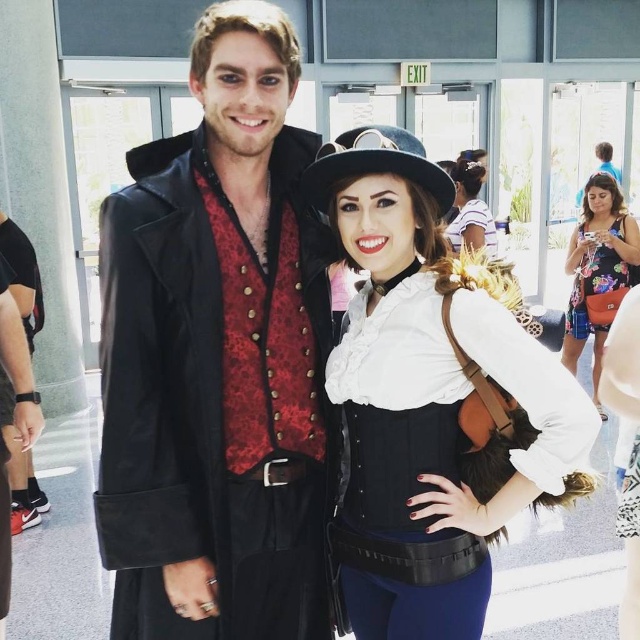
Question: Which point appears closest to the camera in this image?

Choices:
 (A) (580, 276)
 (B) (616, 211)

Answer: (B)

Question: Which point is farther to the camera?

Choices:
 (A) (618, 241)
 (B) (154, 461)
 (C) (456, 180)

Answer: (C)

Question: Which of the following is the closest to the observer?

Choices:
 (A) (620, 211)
 (B) (588, 298)
 (C) (465, 358)
 (D) (176, 529)

Answer: (D)

Question: Is floral print fabric dress at right closer to the viewer compared to white matte hat at upper center?

Choices:
 (A) no
 (B) yes

Answer: (A)

Question: Does floral dress at right appear under white matte hat at upper center?

Choices:
 (A) yes
 (B) no

Answer: (A)

Question: Does matte black coat at center appear on the left side of white matte hat at upper center?

Choices:
 (A) yes
 (B) no

Answer: (A)